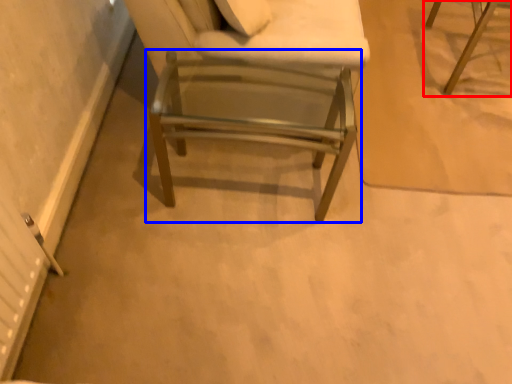
Question: Which point is closer to the camera, chair (highlighted by a red box) or chair (highlighted by a blue box)?

Choices:
 (A) chair
 (B) chair

Answer: (B)